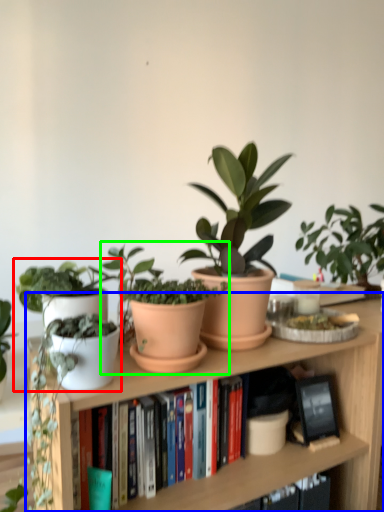
Question: Considering the real-world distances, which object is farthest from houseplant (highlighted by a red box)? bookcase (highlighted by a blue box) or houseplant (highlighted by a green box)?

Choices:
 (A) bookcase
 (B) houseplant

Answer: (A)